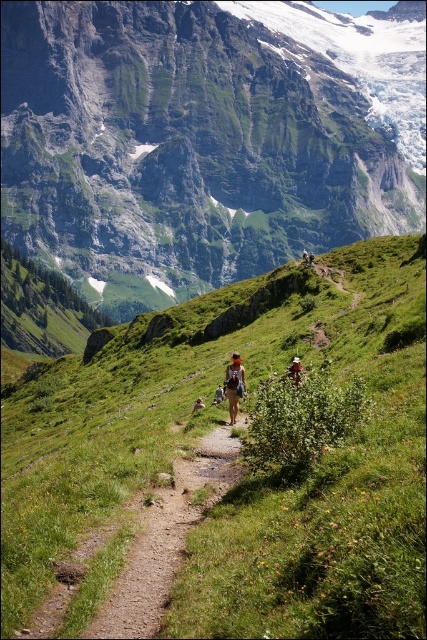
Is rocky gray mountain at upper center to the left of dirt path at center from the viewer's perspective?

In fact, rocky gray mountain at upper center is to the right of dirt path at center.

Is rocky gray mountain at upper center bigger than dirt path at center?

Yes.

Image resolution: width=427 pixels, height=640 pixels. Identify the location of rocky gray mountain at upper center. (204, 138).

Is rocky gray mountain at upper center below camouflage fabric backpack at center?

Incorrect, rocky gray mountain at upper center is not positioned below camouflage fabric backpack at center.

What do you see at coordinates (204, 138) in the screenshot? The width and height of the screenshot is (427, 640). I see `rocky gray mountain at upper center` at bounding box center [204, 138].

Identify the location of rocky gray mountain at upper center. (x=204, y=138).

Who is taller, matte khaki shorts at center or khaki fabric backpack at center?

matte khaki shorts at center is taller.

Who is more distant from viewer, [233,358] or [196,408]?

The point [233,358] is more distant.

Where is `matte khaki shorts at center`? The width and height of the screenshot is (427, 640). matte khaki shorts at center is located at coordinates (233, 385).